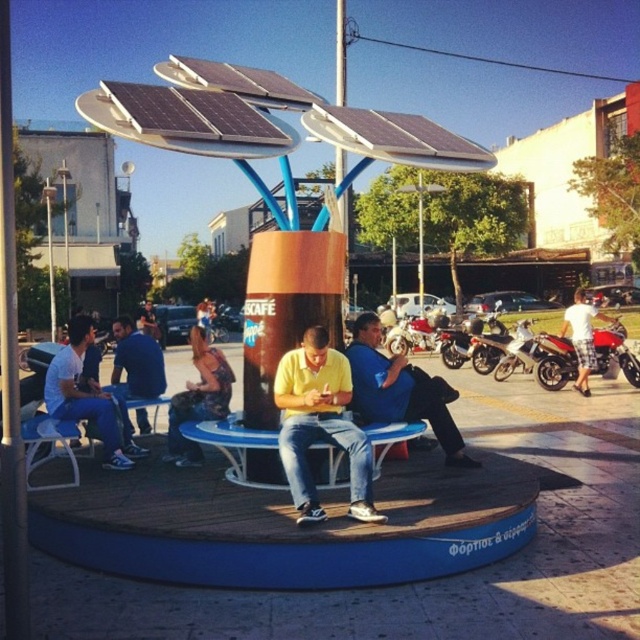
Question: Can you confirm if yellow matte shirt at center is wider than denim jeans at center?

Choices:
 (A) yes
 (B) no

Answer: (A)

Question: Which object appears farthest from the camera in this image?

Choices:
 (A) matte white shirt at left
 (B) blue fabric bench at center
 (C) blue denim jeans at left
 (D) denim jeans at center

Answer: (C)

Question: Does yellow matte shirt at center have a smaller size compared to shiny chrome motorcycle at center right?

Choices:
 (A) yes
 (B) no

Answer: (B)

Question: In this image, where is blue denim jeans at left located relative to shiny chrome motorcycle at center?

Choices:
 (A) above
 (B) below

Answer: (B)

Question: Estimate the real-world distances between objects in this image. Which object is closer to the shiny chrome motorcycle at center?

Choices:
 (A) shiny chrome motorcycle at center right
 (B) blue fabric bench at center
 (C) white plastic table at lower left
 (D) light blue jeans at center

Answer: (A)

Question: Among these points, which one is nearest to the camera?

Choices:
 (A) (445, 362)
 (B) (577, 352)
 (C) (627, 364)

Answer: (B)